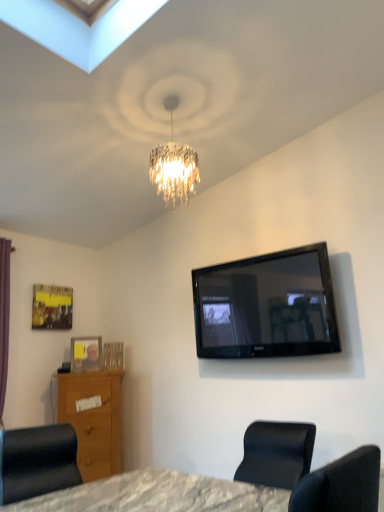
Question: Should I look upward or downward to see clear plastic picture frame at lower left, the first picture frame when ordered from bottom to top?

Choices:
 (A) down
 (B) up

Answer: (A)

Question: Considering the relative sizes of matte black chair at lower left and clear plastic picture frame at lower left, the first picture frame when ordered from bottom to top, in the image provided, is matte black chair at lower left shorter than clear plastic picture frame at lower left, the first picture frame when ordered from bottom to top,?

Choices:
 (A) yes
 (B) no

Answer: (B)

Question: Is matte black chair at lower left positioned behind clear plastic picture frame at lower left, acting as the first picture frame starting from the right?

Choices:
 (A) yes
 (B) no

Answer: (B)

Question: Does matte black chair at lower left appear on the right side of clear plastic picture frame at lower left, the first picture frame when ordered from bottom to top?

Choices:
 (A) no
 (B) yes

Answer: (B)

Question: Is clear plastic picture frame at lower left, the first picture frame when ordered from bottom to top, located within matte black chair at lower left?

Choices:
 (A) yes
 (B) no

Answer: (B)

Question: Is matte black chair at lower left not close to clear plastic picture frame at lower left, acting as the first picture frame starting from the right?

Choices:
 (A) yes
 (B) no

Answer: (A)

Question: From the image's perspective, does matte black chair at lower left appear lower than clear plastic picture frame at lower left, which is the second picture frame from left to right?

Choices:
 (A) no
 (B) yes

Answer: (B)

Question: Does clear plastic picture frame at lower left, the first picture frame when ordered from bottom to top, appear on the left side of black glossy tv at upper right?

Choices:
 (A) no
 (B) yes

Answer: (B)

Question: Is clear plastic picture frame at lower left, acting as the first picture frame starting from the right, shorter than black glossy tv at upper right?

Choices:
 (A) yes
 (B) no

Answer: (A)

Question: Is clear plastic picture frame at lower left, acting as the first picture frame starting from the right, closer to camera compared to black glossy tv at upper right?

Choices:
 (A) no
 (B) yes

Answer: (A)

Question: Is clear plastic picture frame at lower left, placed as the second picture frame when sorted from top to bottom, turned away from black glossy tv at upper right?

Choices:
 (A) yes
 (B) no

Answer: (B)

Question: Does clear plastic picture frame at lower left, acting as the first picture frame starting from the right, have a larger size compared to black glossy tv at upper right?

Choices:
 (A) no
 (B) yes

Answer: (A)

Question: From the image's perspective, is clear plastic picture frame at lower left, which is the second picture frame from left to right, below black glossy tv at upper right?

Choices:
 (A) no
 (B) yes

Answer: (B)

Question: Is clear plastic picture frame at lower left, placed as the second picture frame when sorted from top to bottom, bigger than wooden vanity at lower left?

Choices:
 (A) no
 (B) yes

Answer: (A)